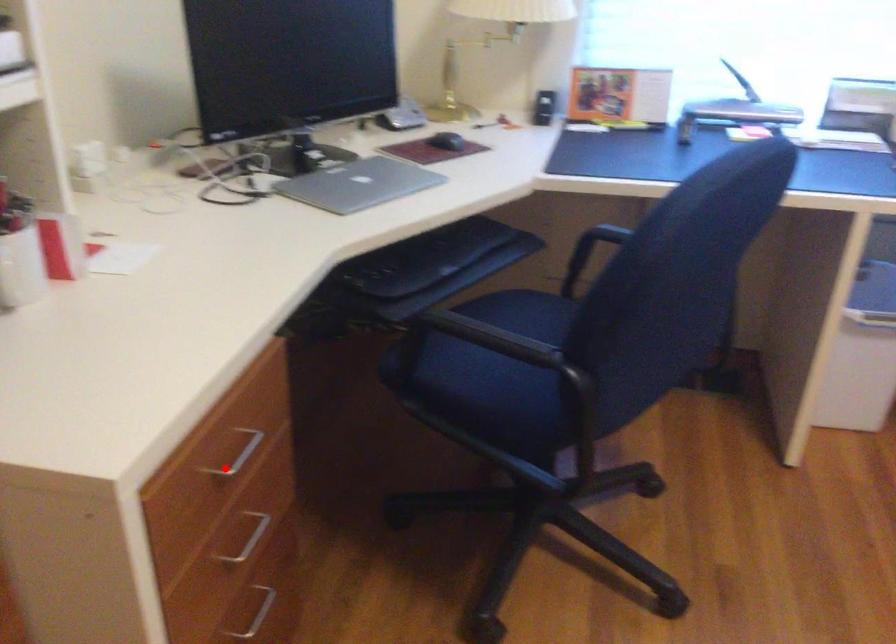
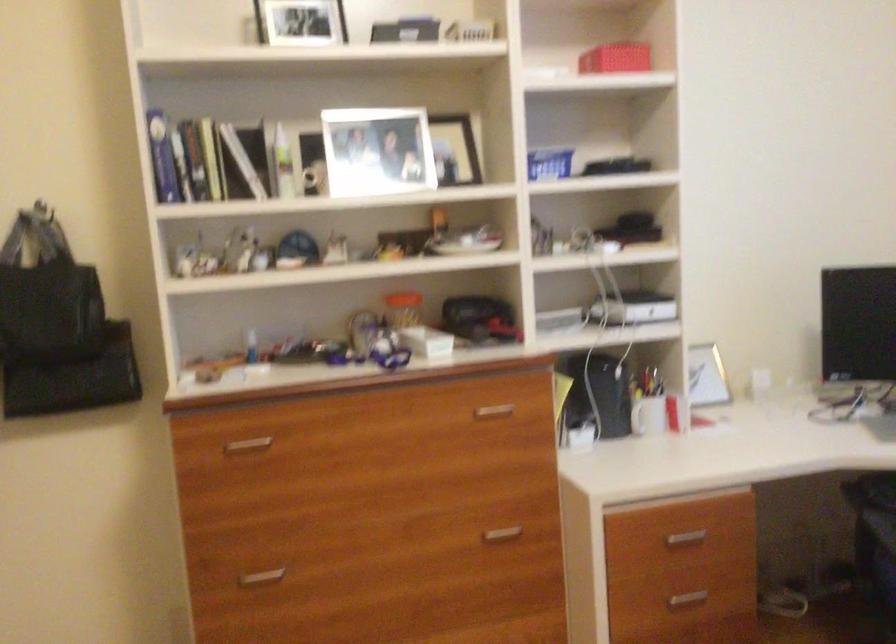
The point at the highlighted location is marked in the first image. Where is the corresponding point in the second image?

(685, 538)